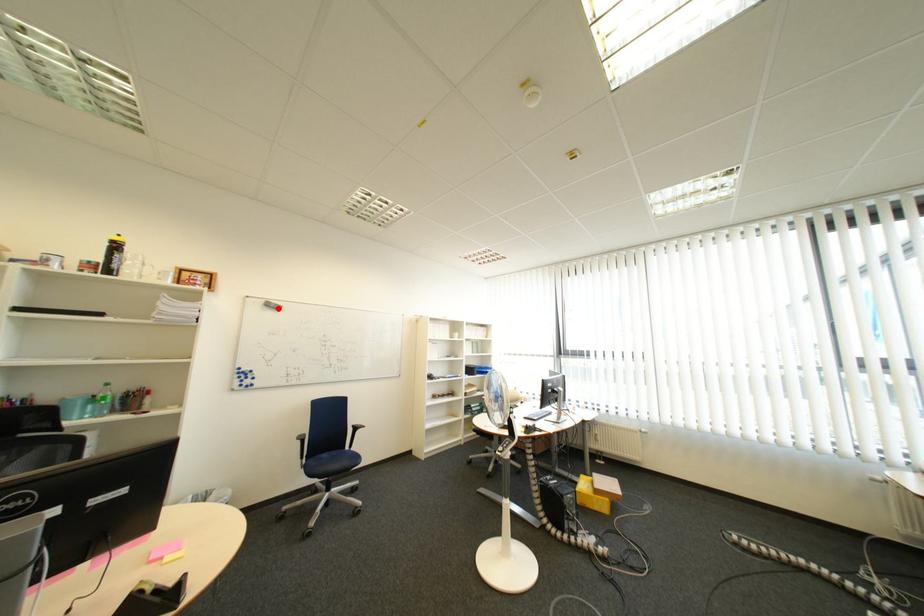
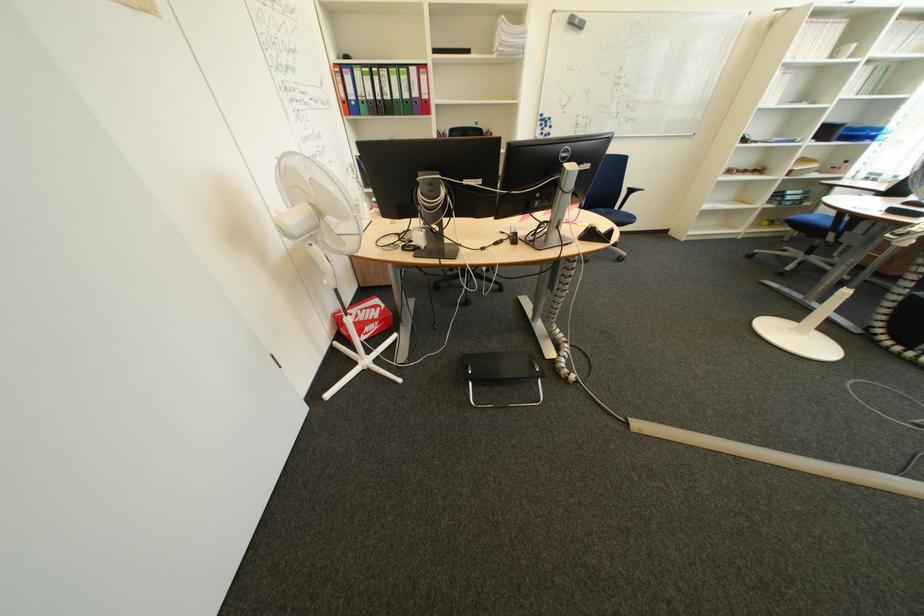
The point at the highlighted location is marked in the first image. Where is the corresponding point in the second image?

(581, 28)